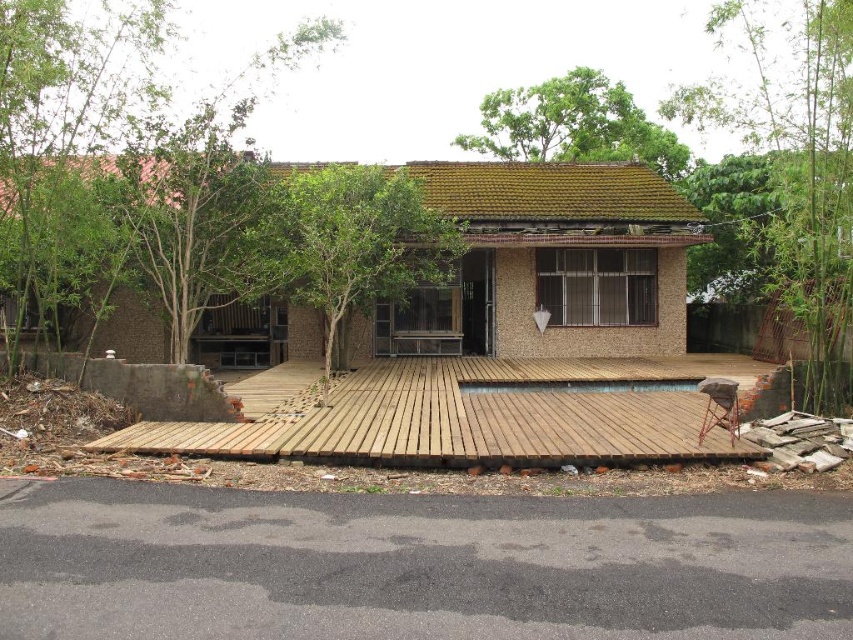
Based on the scene description, where is the green leafy tree at left located in terms of its 2D coordinates?

The green leafy tree at left is located at the 2D coordinates of point (102, 164).

In the scene shown: You are standing at the center of the wooden deck in front of the house. Looking towards the left side of the deck, you see a point marked at coordinates (102, 164). What object is located at that point?

The point at (102, 164) indicates a green leafy tree at left.

From the picture: You are standing in front of the residential structure and notice two green leafy trees. Which tree, the green leafy tree at left or the green leafy tree at upper center, is closer to you?

The green leafy tree at left is closer to you because it is in front of the green leafy tree at upper center.